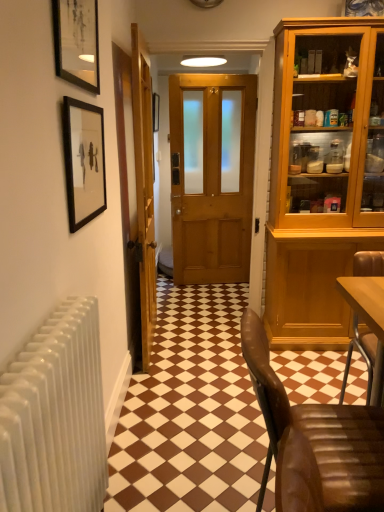
Describe the element at coordinates (212, 175) in the screenshot. I see `wooden door at center, positioned as the 2th door in left-to-right order` at that location.

Describe the element at coordinates (144, 189) in the screenshot. The image size is (384, 512). I see `wooden door at center, marked as the 2th door in a right-to-left arrangement` at that location.

How much space does matte black picture frame at upper left, which is the 2th picture frame in top-to-bottom order, occupy vertically?

matte black picture frame at upper left, which is the 2th picture frame in top-to-bottom order, is 14.67 inches in height.

What do you see at coordinates (84, 161) in the screenshot? I see `black matte picture frame at upper left, positioned as the 2th picture frame in front-to-back order` at bounding box center [84, 161].

Identify the location of brown leather chair at lower right. (314, 441).

Where is `matte black picture frame at center, arranged as the 3th picture frame when viewed from the front`? The image size is (384, 512). matte black picture frame at center, arranged as the 3th picture frame when viewed from the front is located at coordinates (155, 111).

Which is nearer, (134,115) or (356,419)?

The point (356,419) is closer.

Does wooden door at center, marked as the 2th door in a right-to-left arrangement, come in front of brown leather chair at lower right?

No, it is not.

From the picture: Is wooden door at center, positioned as the first door in left-to-right order, shorter than brown leather chair at lower right?

Incorrect, the height of wooden door at center, positioned as the first door in left-to-right order, does not fall short of that of brown leather chair at lower right.

From the image's perspective, between wooden door at center, marked as the 2th door in a right-to-left arrangement, and brown leather chair at lower right, which one is located above?

From the image's view, wooden door at center, marked as the 2th door in a right-to-left arrangement, is above.

Which is in front, point (188, 208) or point (139, 256)?

The point (139, 256) is closer to the camera.

In the scene shown: Which is more to the left, wooden door at center, positioned as the 2th door in left-to-right order, or wooden door at center, positioned as the first door in left-to-right order?

wooden door at center, positioned as the first door in left-to-right order, is more to the left.

From the image's perspective, is wooden door at center, the 1th door from the right, above wooden door at center, positioned as the first door in left-to-right order?

Yes.

What are the coordinates of `chair lying on the right of matte black picture frame at upper left, which is the 1th picture frame in front-to-back order` in the screenshot? It's located at (314, 441).

Can you confirm if matte black picture frame at upper left, which is the 2th picture frame in top-to-bottom order, is bigger than brown leather chair at lower right?

No, matte black picture frame at upper left, which is the 2th picture frame in top-to-bottom order, is not bigger than brown leather chair at lower right.

Is matte black picture frame at upper left, which is the 1th picture frame in front-to-back order, far away from brown leather chair at lower right?

Answer: That's right, there is a large distance between matte black picture frame at upper left, which is the 1th picture frame in front-to-back order, and brown leather chair at lower right.

From the image's perspective, relative to brown leather chair at lower right, is matte black picture frame at upper left, which is counted as the second picture frame, starting from the bottom, above or below?

matte black picture frame at upper left, which is counted as the second picture frame, starting from the bottom, is situated higher than brown leather chair at lower right in the image.

Who is shorter, matte black picture frame at center, the third picture frame positioned from the bottom, or black matte picture frame at upper left, positioned as the 2th picture frame in front-to-back order?

With less height is matte black picture frame at center, the third picture frame positioned from the bottom.

Is matte black picture frame at center, positioned as the 1th picture frame in top-to-bottom order, not near black matte picture frame at upper left, which is the 2th picture frame in back-to-front order?

Yes.

Considering the sizes of objects matte black picture frame at center, positioned as the 1th picture frame in top-to-bottom order, and black matte picture frame at upper left, positioned as the 2th picture frame in front-to-back order, in the image provided, who is bigger, matte black picture frame at center, positioned as the 1th picture frame in top-to-bottom order, or black matte picture frame at upper left, positioned as the 2th picture frame in front-to-back order,?

matte black picture frame at center, positioned as the 1th picture frame in top-to-bottom order.

Which object is closer to the camera, matte black picture frame at center, marked as the 1th picture frame in a back-to-front arrangement, or black matte picture frame at upper left, which appears as the 1th picture frame when ordered from the bottom?

Positioned in front is black matte picture frame at upper left, which appears as the 1th picture frame when ordered from the bottom.

Would you say black matte picture frame at upper left, which is the 2th picture frame in back-to-front order, is to the left or to the right of matte black picture frame at center, positioned as the 1th picture frame in top-to-bottom order, in the picture?

black matte picture frame at upper left, which is the 2th picture frame in back-to-front order, is to the left of matte black picture frame at center, positioned as the 1th picture frame in top-to-bottom order.

From a real-world perspective, is black matte picture frame at upper left, which appears as the 1th picture frame when ordered from the bottom, physically above matte black picture frame at center, positioned as the 1th picture frame in top-to-bottom order?

Incorrect, from a real-world perspective, black matte picture frame at upper left, which appears as the 1th picture frame when ordered from the bottom, is lower than matte black picture frame at center, positioned as the 1th picture frame in top-to-bottom order.

Is matte black picture frame at center, marked as the 1th picture frame in a back-to-front arrangement, at the back of black matte picture frame at upper left, which appears as the 1th picture frame when ordered from the bottom?

No, black matte picture frame at upper left, which appears as the 1th picture frame when ordered from the bottom,'s orientation is not away from matte black picture frame at center, marked as the 1th picture frame in a back-to-front arrangement.

Based on the photo, are black matte picture frame at upper left, which is the 2th picture frame in back-to-front order, and matte black picture frame at center, positioned as the 1th picture frame in top-to-bottom order, making contact?

No, black matte picture frame at upper left, which is the 2th picture frame in back-to-front order, is not making contact with matte black picture frame at center, positioned as the 1th picture frame in top-to-bottom order.

Is matte black picture frame at upper left, which is counted as the second picture frame, starting from the bottom, aimed at wooden door at center, the 1th door from the right?

No, matte black picture frame at upper left, which is counted as the second picture frame, starting from the bottom, is not turned towards wooden door at center, the 1th door from the right.

Is matte black picture frame at upper left, which is the 2th picture frame in top-to-bottom order, not close to wooden door at center, the 1th door from the right?

Yes, matte black picture frame at upper left, which is the 2th picture frame in top-to-bottom order, and wooden door at center, the 1th door from the right, are located far from each other.

Is matte black picture frame at upper left, which is counted as the second picture frame, starting from the bottom, bigger than wooden door at center, positioned as the 2th door in left-to-right order?

No.

Looking at this image, how distant is matte black picture frame at upper left, which is counted as the second picture frame, starting from the bottom, from wooden door at center, positioned as the 2th door in left-to-right order?

7.79 feet.

Can you confirm if matte black picture frame at center, positioned as the 1th picture frame in top-to-bottom order, is positioned to the left of brown leather chair at lower right?

Correct, you'll find matte black picture frame at center, positioned as the 1th picture frame in top-to-bottom order, to the left of brown leather chair at lower right.

From the image's perspective, which object appears higher, matte black picture frame at center, the third picture frame positioned from the bottom, or brown leather chair at lower right?

matte black picture frame at center, the third picture frame positioned from the bottom.

Which object is more forward, matte black picture frame at center, positioned as the 1th picture frame in top-to-bottom order, or brown leather chair at lower right?

brown leather chair at lower right is in front.

The width and height of the screenshot is (384, 512). In order to click on door that is the 1st object located above the brown leather chair at lower right (from the image's perspective) in this screenshot , I will do `click(144, 189)`.

The height and width of the screenshot is (512, 384). Identify the location of door in front of the wooden door at center, positioned as the 2th door in left-to-right order. (144, 189).

Based on their spatial positions, is matte black picture frame at upper left, which is the 2th picture frame in top-to-bottom order, or wooden door at center, positioned as the 2th door in left-to-right order, closer to black matte picture frame at upper left, which is the 2th picture frame in back-to-front order?

Based on the image, matte black picture frame at upper left, which is the 2th picture frame in top-to-bottom order, appears to be nearer to black matte picture frame at upper left, which is the 2th picture frame in back-to-front order.

Estimate the real-world distances between objects in this image. Which object is further from black matte picture frame at upper left, which appears as the 1th picture frame when ordered from the bottom, wooden door at center, marked as the 2th door in a right-to-left arrangement, or brown leather chair at lower right?

→ brown leather chair at lower right lies further to black matte picture frame at upper left, which appears as the 1th picture frame when ordered from the bottom, than the other object.

Considering their positions, is wooden door at center, the 1th door from the right, positioned further to brown leather chair at lower right than matte black picture frame at center, positioned as the 1th picture frame in top-to-bottom order?

The object further to brown leather chair at lower right is matte black picture frame at center, positioned as the 1th picture frame in top-to-bottom order.

Based on their spatial positions, is wooden door at center, the 1th door from the right, or matte black picture frame at center, positioned as the 1th picture frame in top-to-bottom order, further from wooden door at center, marked as the 2th door in a right-to-left arrangement?

matte black picture frame at center, positioned as the 1th picture frame in top-to-bottom order.

When comparing their distances from matte black picture frame at upper left, which is counted as the second picture frame, starting from the bottom, does wooden door at center, positioned as the 2th door in left-to-right order, or brown leather chair at lower right seem further?

The object further to matte black picture frame at upper left, which is counted as the second picture frame, starting from the bottom, is wooden door at center, positioned as the 2th door in left-to-right order.

Considering their positions, is wooden door at center, positioned as the first door in left-to-right order, positioned further to matte black picture frame at center, marked as the 1th picture frame in a back-to-front arrangement, than brown leather chair at lower right?

Among the two, brown leather chair at lower right is located further to matte black picture frame at center, marked as the 1th picture frame in a back-to-front arrangement.

Which object lies further to the anchor point black matte picture frame at upper left, which is the 2th picture frame in back-to-front order, matte black picture frame at center, positioned as the 1th picture frame in top-to-bottom order, or brown leather chair at lower right?

matte black picture frame at center, positioned as the 1th picture frame in top-to-bottom order, is positioned further to the anchor black matte picture frame at upper left, which is the 2th picture frame in back-to-front order.

From the image, which object appears to be farther from brown leather chair at lower right, matte black picture frame at upper left, which is the 1th picture frame in front-to-back order, or wooden door at center, positioned as the first door in left-to-right order?

Among the two, wooden door at center, positioned as the first door in left-to-right order, is located further to brown leather chair at lower right.

Locate an element on the screen. The width and height of the screenshot is (384, 512). door between wooden door at center, marked as the 2th door in a right-to-left arrangement, and matte black picture frame at center, marked as the 1th picture frame in a back-to-front arrangement, in the front-back direction is located at coordinates (212, 175).

Find the location of a particular element. door positioned between black matte picture frame at upper left, the third picture frame in the top-to-bottom sequence, and wooden door at center, the 1th door from the right, from near to far is located at coordinates (144, 189).

This screenshot has width=384, height=512. Find the location of `door between brown leather chair at lower right and wooden door at center, the 1th door from the right, in the front-back direction`. door between brown leather chair at lower right and wooden door at center, the 1th door from the right, in the front-back direction is located at coordinates (144, 189).

Identify the location of picture frame between matte black picture frame at upper left, arranged as the third picture frame when viewed from the back, and brown leather chair at lower right from top to bottom. (84, 161).